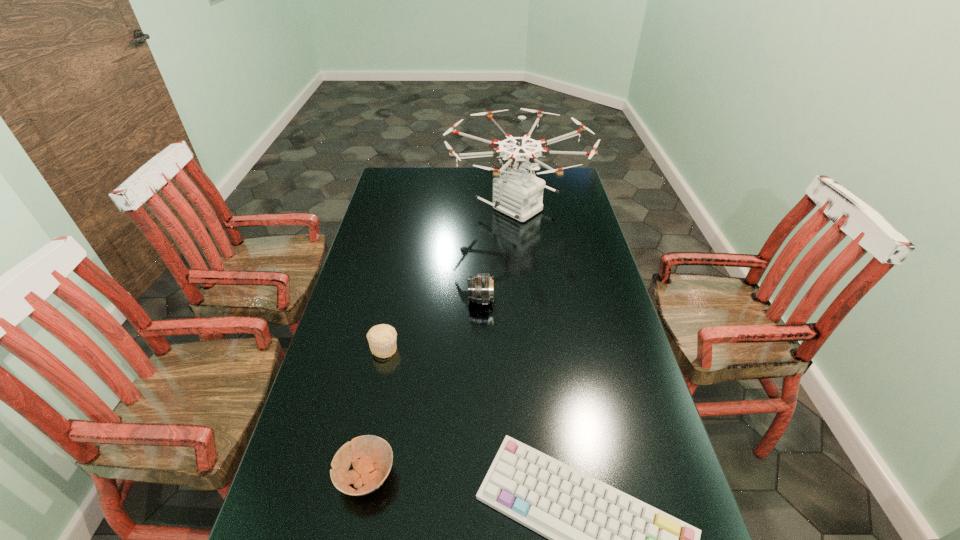
Find the location of `the farthest object`. the farthest object is located at coordinates (519, 194).

The image size is (960, 540). Find the location of `drone`. drone is located at coordinates (519, 194).

I want to click on telephoto lens, so click(480, 286).

Locate an element on the screen. Image resolution: width=960 pixels, height=540 pixels. the second farthest object is located at coordinates (480, 286).

Where is `muffin`? Image resolution: width=960 pixels, height=540 pixels. muffin is located at coordinates (382, 338).

This screenshot has width=960, height=540. What are the coordinates of `the third shortest object` in the screenshot? It's located at (382, 338).

You are a GUI agent. You are given a task and a screenshot of the screen. Output one action in this format:
    pyautogui.click(x=<x>, y=<y>)
    Task: Click on the bowl
    Image resolution: width=960 pixels, height=540 pixels.
    Given the screenshot: What is the action you would take?
    pyautogui.click(x=371, y=470)

The image size is (960, 540). Identify the location of free space located on the front of the drone. (526, 293).

This screenshot has width=960, height=540. In order to click on vacant space located at the front element of the fourth nearest object in this screenshot , I will do `click(372, 300)`.

Find the location of a particular element. The width and height of the screenshot is (960, 540). vacant space located at the front element of the fourth nearest object is located at coordinates (428, 300).